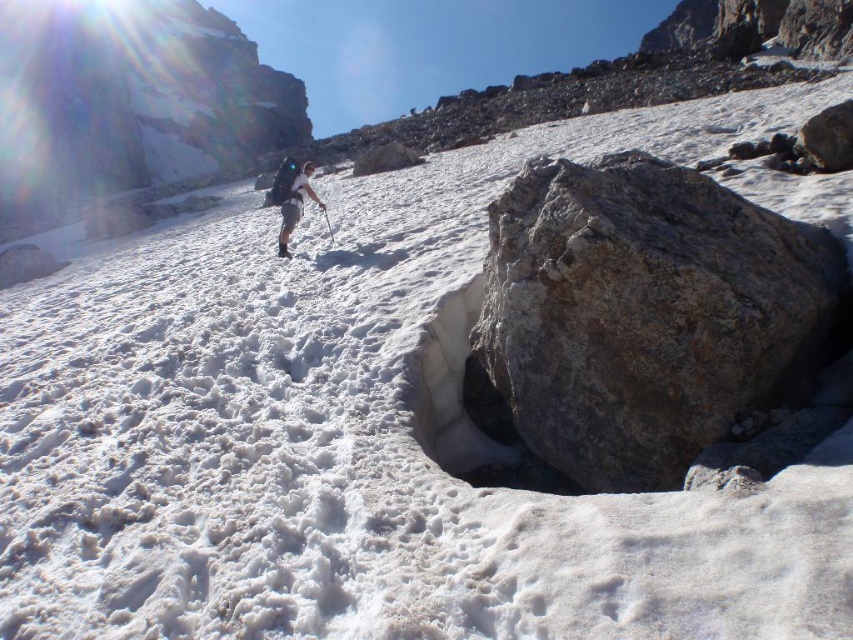
You are standing at the point marked as point (659, 216) in the mountainous landscape. If you want to take a photo of the hiker walking uphill towards the left with your camera, which is 5.11 meters away from you, will the hiker be in the frame?

The point (659, 216) is 5.11 meters away from the camera. Since the hiker is in the midground of the image, which is likely within this distance, the hiker should be in the frame when taking the photo from that point.

You are a hiker trying to reach the summit and see the gray rough rock at center and the light brown fabric backpack at center. Which object is closer to your current position if you are facing the direction the hiker is walking?

The gray rough rock at center is to the right of the light brown fabric backpack at center, so if you are facing the direction the hiker is walking, the light brown fabric backpack at center is closer to your current position because it is positioned to the left of the gray rough rock at center.

You are a drone operator trying to capture the hiker in the mountainous landscape. You have two points marked as potential camera positions. The first point is at coordinates point (531, 336) and the second is at point (288, 184). Which point is closer to the hiker?

Point (531, 336) is closer to the viewer than point (288, 184), so the camera positioned at point (531, 336) would be closer to the hiker.